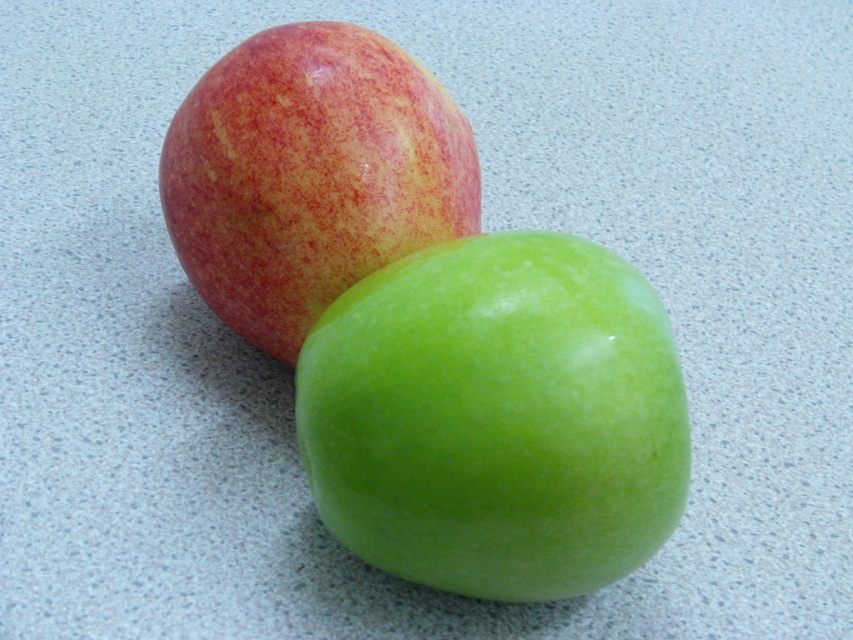
Question: Can you confirm if green shiny apple at center is thinner than matte red apple at upper left?

Choices:
 (A) yes
 (B) no

Answer: (B)

Question: Which object appears closest to the camera in this image?

Choices:
 (A) matte red apple at upper left
 (B) green shiny apple at center

Answer: (B)

Question: Observing the image, what is the correct spatial positioning of green shiny apple at center in reference to matte red apple at upper left?

Choices:
 (A) above
 (B) below

Answer: (B)

Question: Is green shiny apple at center to the left of matte red apple at upper left from the viewer's perspective?

Choices:
 (A) no
 (B) yes

Answer: (A)